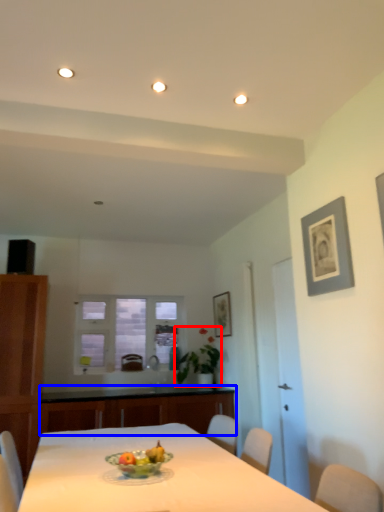
Question: Which point is further to the camera, plant (highlighted by a red box) or counter top (highlighted by a blue box)?

Choices:
 (A) plant
 (B) counter top

Answer: (A)